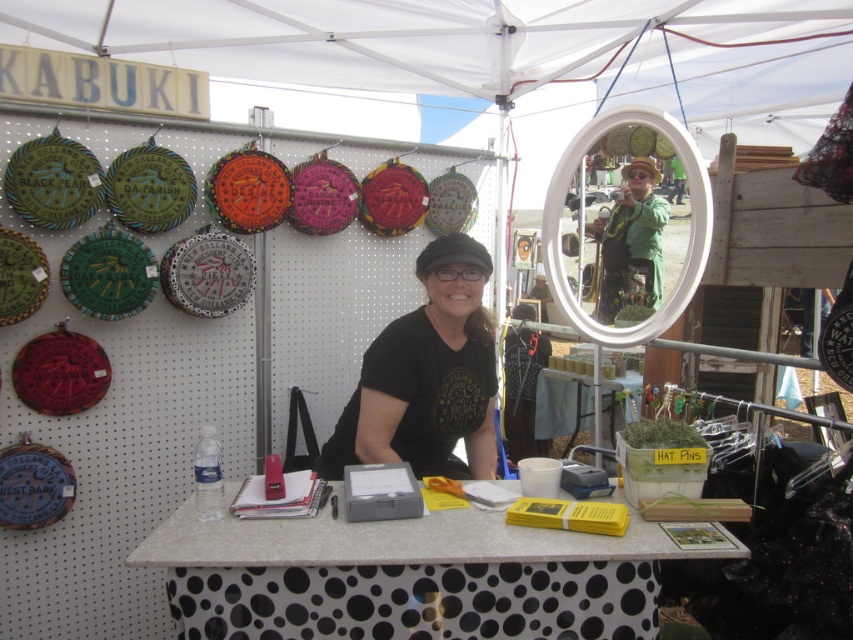
Question: Does green fabric jacket at center appear under white polka dot table at center?

Choices:
 (A) no
 (B) yes

Answer: (A)

Question: Which point is closer to the camera?

Choices:
 (A) (538, 419)
 (B) (177, 522)
 (C) (654, 300)
 (D) (416, 365)

Answer: (B)

Question: Estimate the real-world distances between objects in this image. Which object is closer to the green fabric jacket at center?

Choices:
 (A) white polka dot table at center
 (B) black dotted fabric table at center

Answer: (A)

Question: Can you confirm if black matte t-shirt at center is smaller than white polka dot table at center?

Choices:
 (A) yes
 (B) no

Answer: (A)

Question: Is black dotted fabric table at center further to camera compared to black matte t-shirt at center?

Choices:
 (A) yes
 (B) no

Answer: (B)

Question: Among these points, which one is nearest to the camera?

Choices:
 (A) (614, 198)
 (B) (561, 579)
 (C) (589, 401)

Answer: (B)